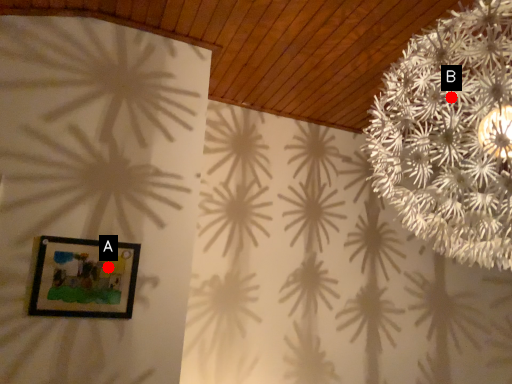
Question: Two points are circled on the image, labeled by A and B beside each circle. Which point is closer to the camera?

Choices:
 (A) A is closer
 (B) B is closer

Answer: (B)